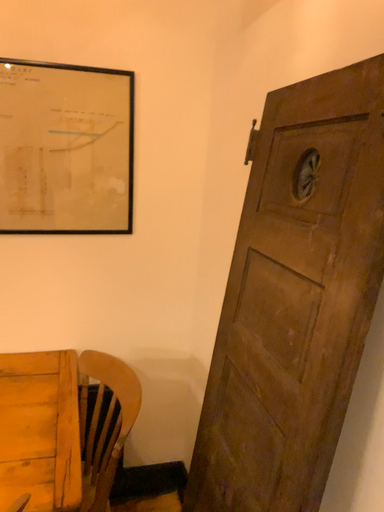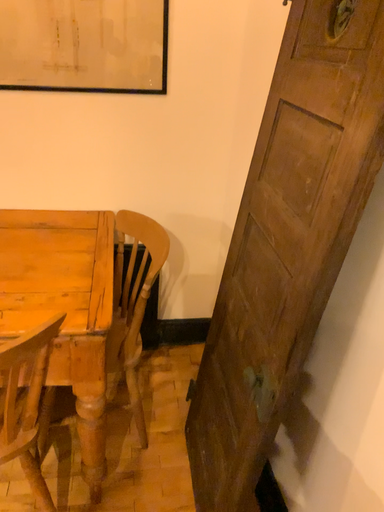
Question: How did the camera likely rotate when shooting the video?

Choices:
 (A) rotated right
 (B) rotated left

Answer: (B)